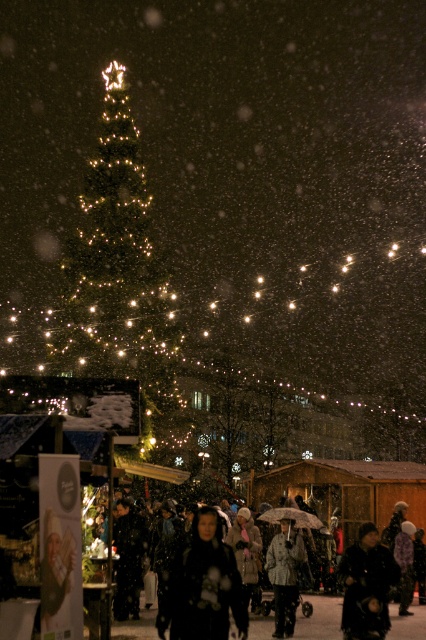
Is black wool coat at lower center bigger than gray textured coat at center?

No, black wool coat at lower center is not bigger than gray textured coat at center.

Image resolution: width=426 pixels, height=640 pixels. What do you see at coordinates (367, 586) in the screenshot? I see `black wool coat at lower center` at bounding box center [367, 586].

This screenshot has width=426, height=640. What are the coordinates of `black wool coat at lower center` in the screenshot? It's located at (367, 586).

Is point (262, 620) positioned after point (293, 552)?

Yes, point (262, 620) is behind point (293, 552).

In the scene shown: Who is more distant from viewer, (336, 634) or (287, 572)?

The point (287, 572) is more distant.

Is point (336, 598) positioned after point (287, 579)?

That is True.

Where is `black matte coat at center`? The height and width of the screenshot is (640, 426). black matte coat at center is located at coordinates (319, 618).

Based on the photo, how distant is black matte coat at center from dark gray fabric coat at center?

black matte coat at center and dark gray fabric coat at center are 25.76 feet apart from each other.

Can you confirm if black matte coat at center is smaller than dark gray fabric coat at center?

No.

Is point (301, 620) positioned after point (120, 592)?

Yes, it is.

What are the coordinates of `black matte coat at center` in the screenshot? It's located at (319, 618).